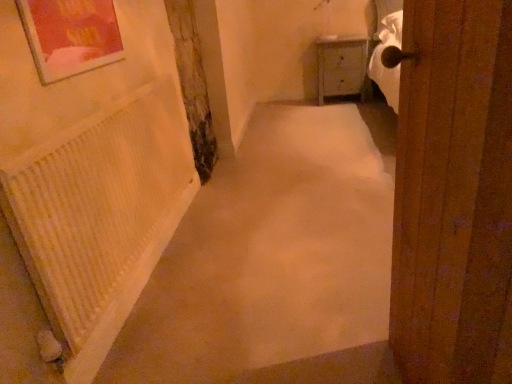
Where is `wooden door at right`? wooden door at right is located at coordinates (454, 195).

What do you see at coordinates (454, 195) in the screenshot?
I see `wooden door at right` at bounding box center [454, 195].

Identify the location of beige carpet at center. Image resolution: width=512 pixels, height=384 pixels. (276, 261).

Identify the location of wooden door at right. This screenshot has height=384, width=512. (454, 195).

Does beige carpet at center have a greater height compared to white wood cabinet at upper right?

No, beige carpet at center is not taller than white wood cabinet at upper right.

Is beige carpet at center outside of white wood cabinet at upper right?

beige carpet at center lies outside white wood cabinet at upper right's area.

Is beige carpet at center in contact with white wood cabinet at upper right?

beige carpet at center is not next to white wood cabinet at upper right, and they're not touching.

From the image's perspective, does beige carpet at center appear higher than white wood cabinet at upper right?

No, from the image's perspective, beige carpet at center is not above white wood cabinet at upper right.

Which of these two, white textured radiator at left or beige carpet at center, stands taller?

white textured radiator at left is taller.

This screenshot has height=384, width=512. I want to click on radiator below the beige carpet at center (from the image's perspective), so click(98, 207).

Does white textured radiator at left touch beige carpet at center?

white textured radiator at left and beige carpet at center are not in contact.

From the image's perspective, would you say white textured radiator at left is positioned over beige carpet at center?

No.

Does beige carpet at center have a greater width compared to white textured radiator at left?

Correct, the width of beige carpet at center exceeds that of white textured radiator at left.

Who is smaller, beige carpet at center or white textured radiator at left?

Smaller between the two is white textured radiator at left.

How many degrees apart are the facing directions of beige carpet at center and white textured radiator at left?

The facing directions of beige carpet at center and white textured radiator at left are 90 degrees apart.

What's the angular difference between white wood cabinet at upper right and wooden door at right's facing directions?

There is a 96-degree angle between the facing directions of white wood cabinet at upper right and wooden door at right.

Consider the image. Is white wood cabinet at upper right aimed at wooden door at right?

Yes, white wood cabinet at upper right is oriented towards wooden door at right.

From the image's perspective, between white wood cabinet at upper right and wooden door at right, who is located below?

From the image's view, wooden door at right is below.

Is point (351, 72) positioned before point (500, 175)?

No, (351, 72) is further to viewer.

Can you confirm if white wood cabinet at upper right is smaller than beige carpet at center?

Yes.

Looking at this image, from a real-world perspective, is white wood cabinet at upper right below beige carpet at center?

No, from a real-world perspective, white wood cabinet at upper right is not under beige carpet at center.

Is white wood cabinet at upper right oriented away from beige carpet at center?

white wood cabinet at upper right does not have its back to beige carpet at center.

In the scene shown: Can you tell me how much white wood cabinet at upper right and beige carpet at center differ in facing direction?

The angular difference between white wood cabinet at upper right and beige carpet at center is 2.07 degrees.

Where is `radiator behind the wooden door at right`? This screenshot has height=384, width=512. radiator behind the wooden door at right is located at coordinates (98, 207).

Is wooden door at right taller or shorter than white textured radiator at left?

Clearly, wooden door at right is taller compared to white textured radiator at left.

Is wooden door at right beside white textured radiator at left?

wooden door at right and white textured radiator at left are clearly separated.

From the picture: Considering the positions of objects wooden door at right and white textured radiator at left in the image provided, who is behind, wooden door at right or white textured radiator at left?

Positioned behind is white textured radiator at left.

Is wooden door at right oriented away from beige carpet at center?

wooden door at right is not turned away from beige carpet at center.

Does wooden door at right have a lesser width compared to beige carpet at center?

Yes.

From the image's perspective, is wooden door at right located above or below beige carpet at center?

wooden door at right is below beige carpet at center.

In the image, is wooden door at right on the left side or the right side of beige carpet at center?

Clearly, wooden door at right is on the left of beige carpet at center in the image.

Image resolution: width=512 pixels, height=384 pixels. Identify the location of furniture lying above the beige carpet at center (from the image's perspective). (342, 66).

Identify the location of radiator below the beige carpet at center (from the image's perspective). The image size is (512, 384). (98, 207).

Which object lies further to the anchor point beige carpet at center, white textured radiator at left or white wood cabinet at upper right?

white wood cabinet at upper right is positioned further to the anchor beige carpet at center.

Looking at the image, which one is located closer to wooden door at right, white textured radiator at left or beige carpet at center?

beige carpet at center is positioned closer to the anchor wooden door at right.

Looking at the image, which one is located closer to white textured radiator at left, beige carpet at center or white wood cabinet at upper right?

The object closer to white textured radiator at left is beige carpet at center.

From the image, which object appears to be nearer to white textured radiator at left, beige carpet at center or wooden door at right?

beige carpet at center lies closer to white textured radiator at left than the other object.

Estimate the real-world distances between objects in this image. Which object is closer to white wood cabinet at upper right, beige carpet at center or white textured radiator at left?

The object closer to white wood cabinet at upper right is beige carpet at center.

Looking at the image, which one is located further to white wood cabinet at upper right, white textured radiator at left or beige carpet at center?

Based on the image, white textured radiator at left appears to be further to white wood cabinet at upper right.

From the image, which object appears to be nearer to beige carpet at center, white wood cabinet at upper right or white textured radiator at left?

white textured radiator at left is closer to beige carpet at center.

Considering their positions, is beige carpet at center positioned further to wooden door at right than white wood cabinet at upper right?

white wood cabinet at upper right.

Locate an element on the screen. The height and width of the screenshot is (384, 512). alley between white textured radiator at left and white wood cabinet at upper right along the z-axis is located at coordinates (276, 261).

Where is `door between white textured radiator at left and beige carpet at center in the horizontal direction`? The height and width of the screenshot is (384, 512). door between white textured radiator at left and beige carpet at center in the horizontal direction is located at coordinates (454, 195).

The width and height of the screenshot is (512, 384). What are the coordinates of `radiator located between wooden door at right and white wood cabinet at upper right in the depth direction` in the screenshot? It's located at (98, 207).

The image size is (512, 384). What are the coordinates of `alley located between wooden door at right and white wood cabinet at upper right in the depth direction` in the screenshot? It's located at (276, 261).